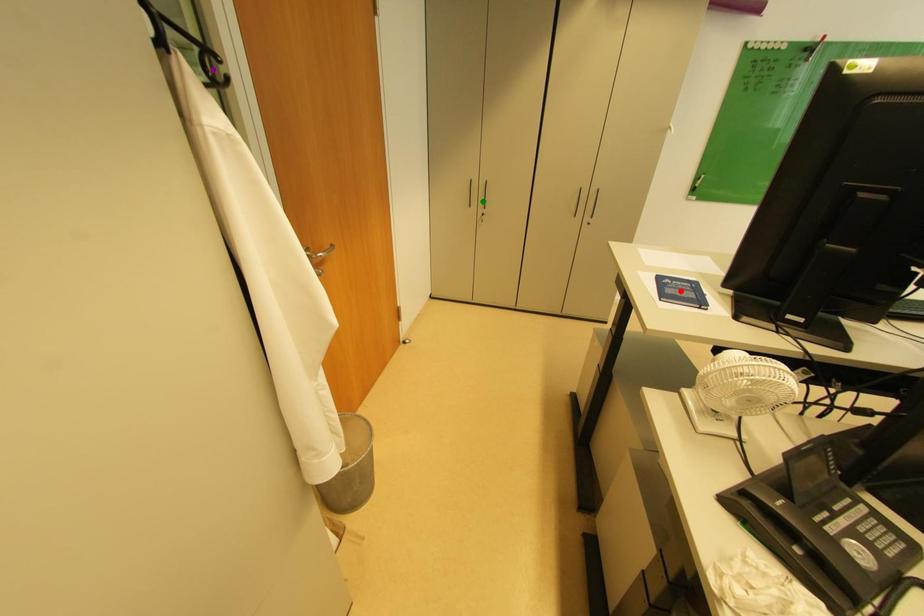
Order these from farthest to nearest:
- red point
- purple point
- green point

green point < red point < purple point